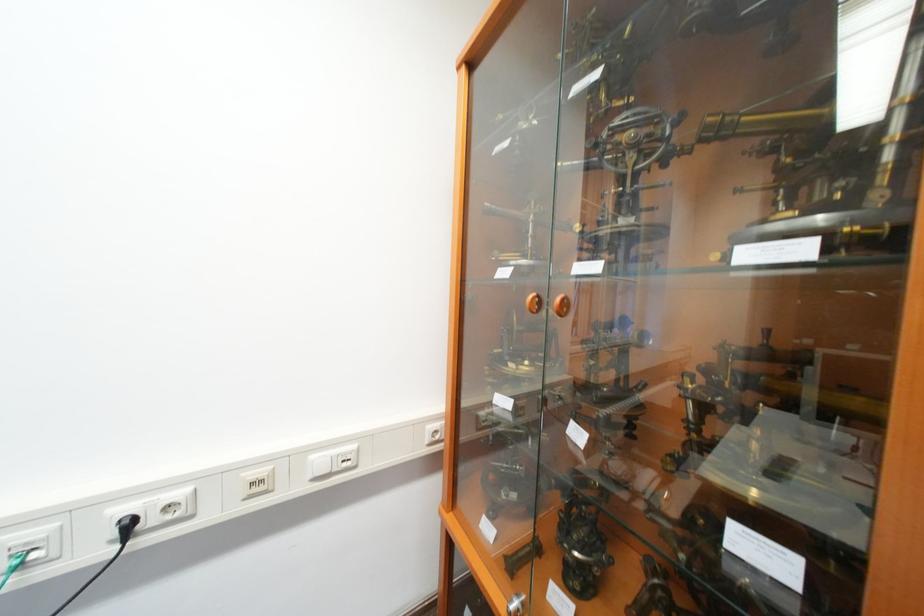
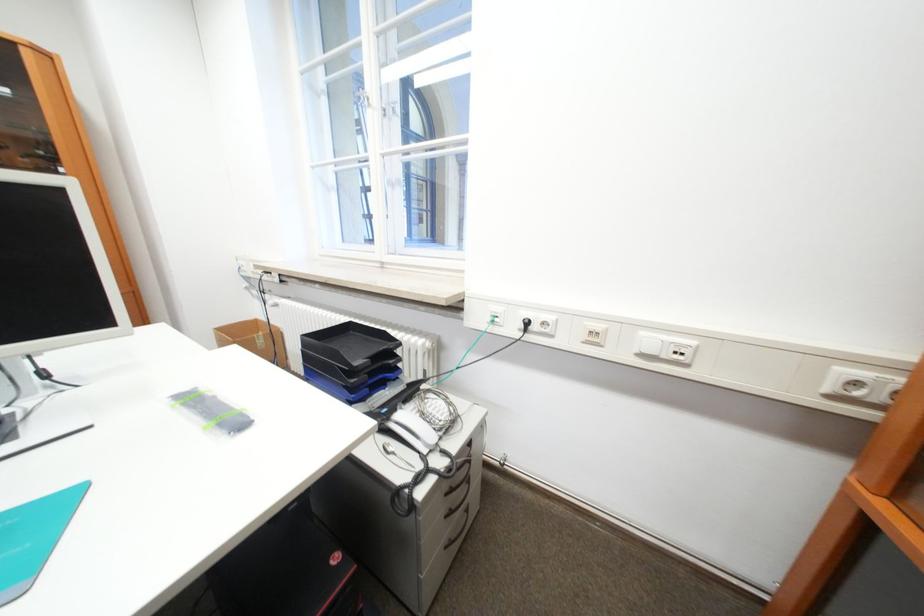
Question: The camera is either moving clockwise (left) or counter-clockwise (right) around the object. The first image is from the beginning of the video and the second image is from the end. Is the camera moving left or right when shooting the video?

Choices:
 (A) Left
 (B) Right

Answer: (B)